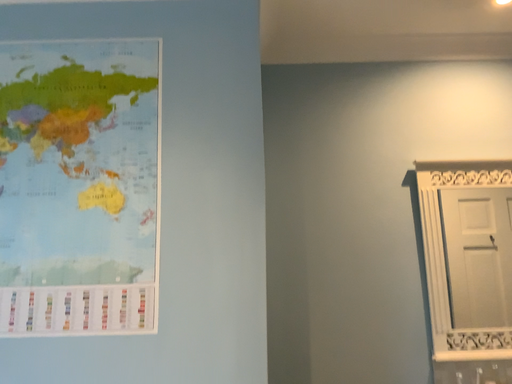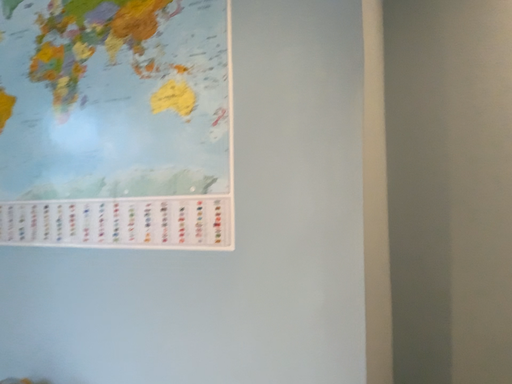
Question: Which way did the camera rotate in the video?

Choices:
 (A) rotated upward
 (B) rotated downward

Answer: (B)